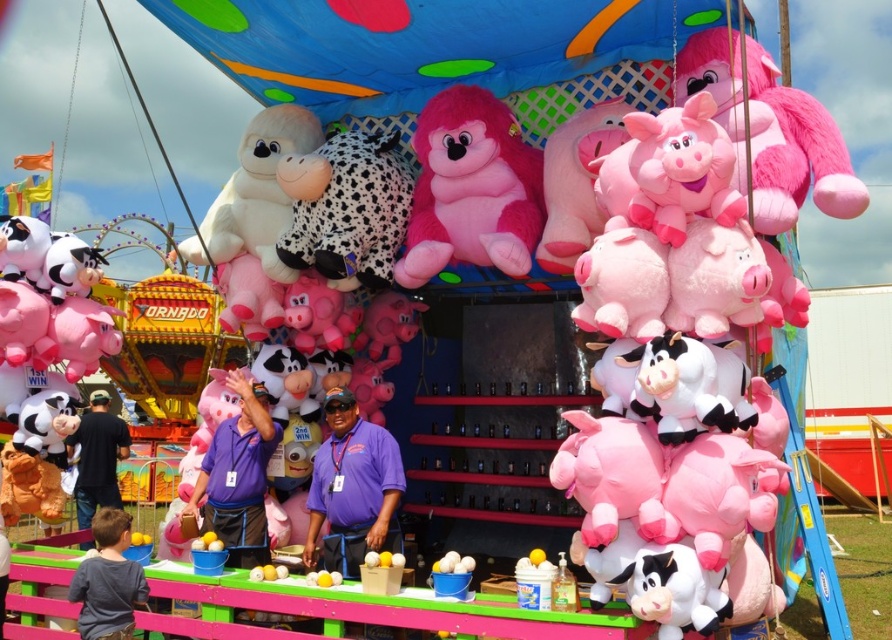
Question: Which point appears farthest from the camera in this image?

Choices:
 (A) (814, 150)
 (B) (120, 518)
 (C) (332, 433)
 (D) (128, 433)

Answer: (D)

Question: Does fluffy pink plush monkey at upper right appear on the right side of purple shirt at center?

Choices:
 (A) no
 (B) yes

Answer: (B)

Question: Is pink plush gorilla at center smaller than purple shirt at center?

Choices:
 (A) yes
 (B) no

Answer: (B)

Question: Among these objects, which one is nearest to the camera?

Choices:
 (A) purple shirt at center
 (B) spotted black and white plush at center

Answer: (A)

Question: Can you confirm if fluffy pink plush monkey at upper right is positioned to the right of black shirt at lower left?

Choices:
 (A) yes
 (B) no

Answer: (A)

Question: Among these points, which one is nearest to the camera?

Choices:
 (A) (334, 173)
 (B) (124, 424)
 (C) (742, 188)
 (D) (122, 532)

Answer: (C)